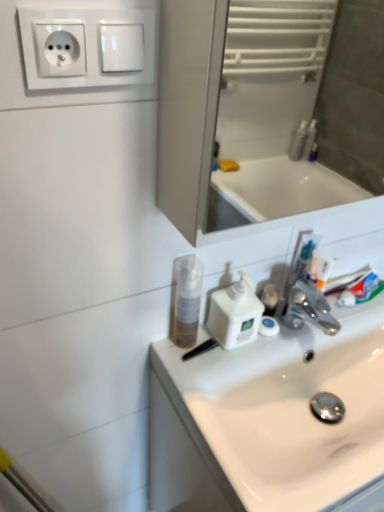
Where is `free space in front of white plastic soap dispenser at center`? The image size is (384, 512). free space in front of white plastic soap dispenser at center is located at coordinates click(226, 377).